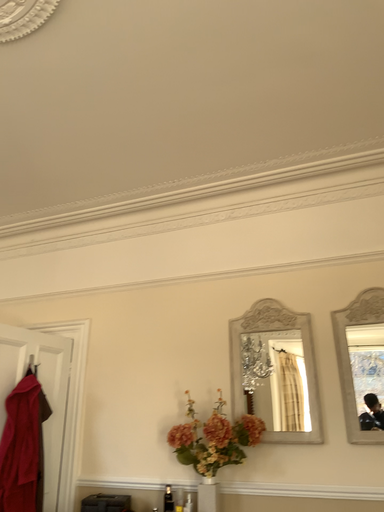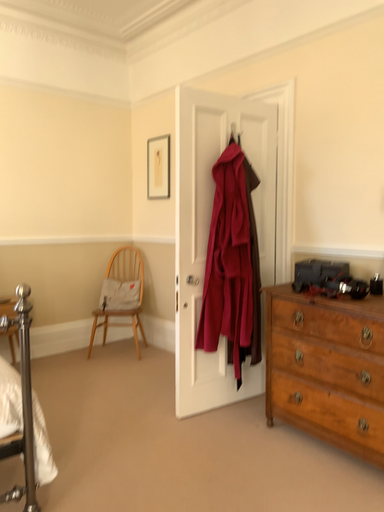
Question: How did the camera likely rotate when shooting the video?

Choices:
 (A) rotated left
 (B) rotated right

Answer: (A)